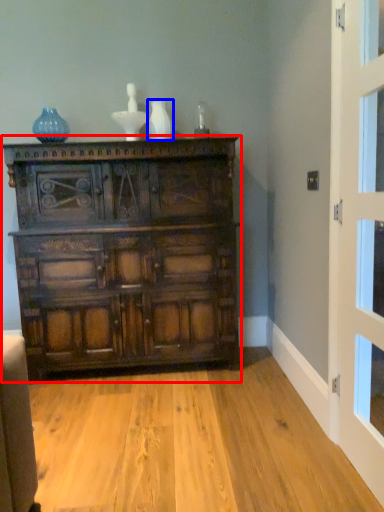
Question: Which object is closer to the camera taking this photo, chest of drawers (highlighted by a red box) or vase (highlighted by a blue box)?

Choices:
 (A) chest of drawers
 (B) vase

Answer: (A)